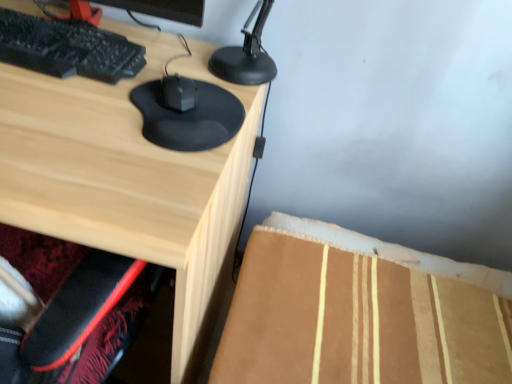
Question: From a real-world perspective, is matte wood desk at center positioned above or below black matte mouse at center?

Choices:
 (A) below
 (B) above

Answer: (A)

Question: Relative to black matte mouse at center, is matte wood desk at center in front or behind?

Choices:
 (A) front
 (B) behind

Answer: (A)

Question: Choose the correct answer: Is matte wood desk at center inside black matte mouse at center or outside it?

Choices:
 (A) inside
 (B) outside

Answer: (B)

Question: Relative to matte wood desk at center, is black matte mouse at center in front or behind?

Choices:
 (A) behind
 (B) front

Answer: (A)

Question: From their relative heights in the image, would you say black matte mouse at center is taller or shorter than matte wood desk at center?

Choices:
 (A) tall
 (B) short

Answer: (B)

Question: From the image's perspective, is black matte mouse at center positioned above or below matte wood desk at center?

Choices:
 (A) below
 (B) above

Answer: (B)

Question: Considering the positions of point (217, 112) and point (48, 124), is point (217, 112) closer or farther from the camera than point (48, 124)?

Choices:
 (A) farther
 (B) closer

Answer: (A)